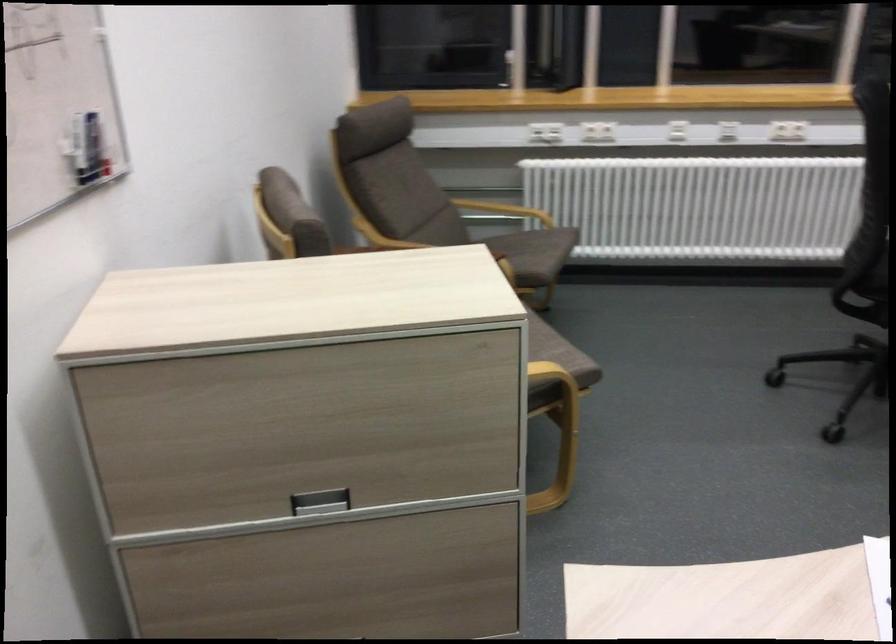
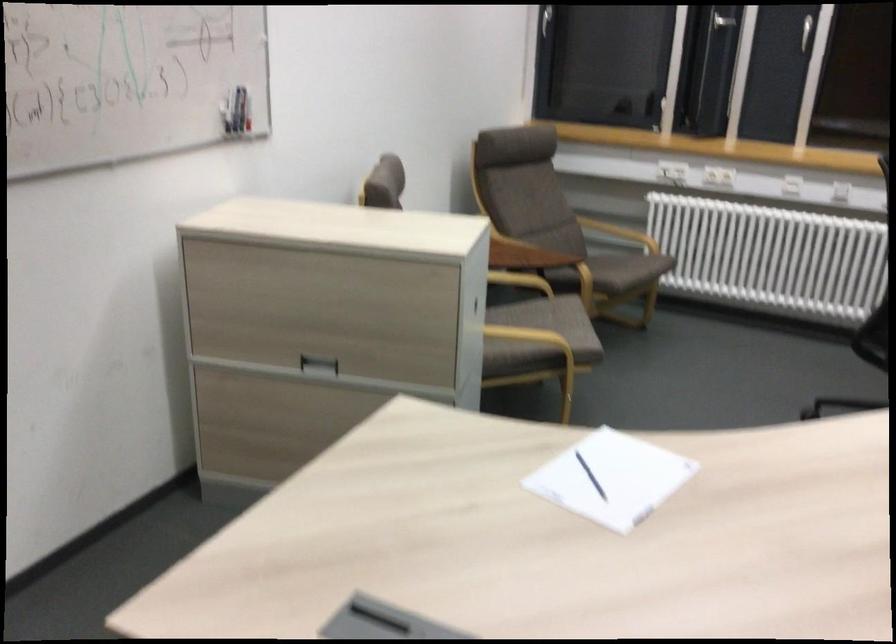
Find the pixel in the second image that matches (x=98, y=153) in the first image.

(248, 114)